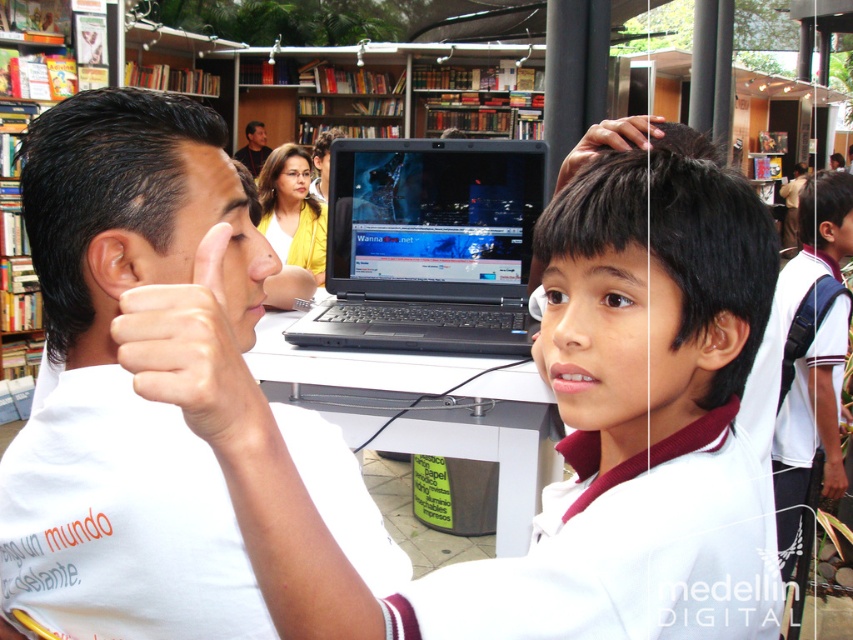
You are standing at the point labeled point (149, 365) and want to walk to the point labeled point (479, 304). Which direction should you move in to reach your destination?

To reach point (479, 304) from point (149, 365), you should move upwards because point (479, 304) is behind point (149, 365).